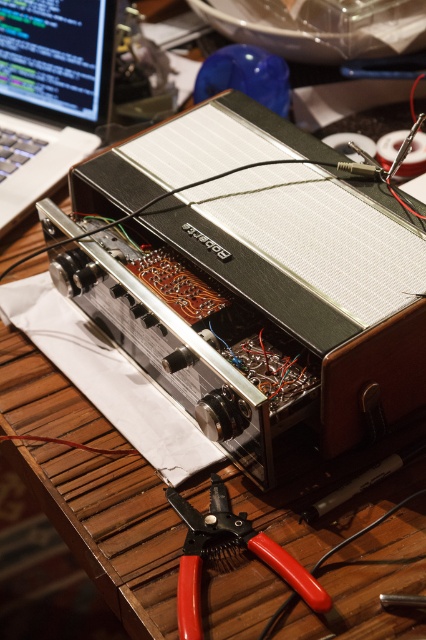
Question: Can you confirm if metallic silver amplifier at center is bigger than red plastic pliers at lower center?

Choices:
 (A) no
 (B) yes

Answer: (B)

Question: Where is metallic silver amplifier at center located in relation to red plastic pliers at lower center in the image?

Choices:
 (A) right
 (B) left

Answer: (A)

Question: Which point is farther to the camera?

Choices:
 (A) red plastic pliers at lower center
 (B) metallic silver amplifier at center
 (C) matte black laptop at upper left

Answer: (C)

Question: Among these points, which one is nearest to the camera?

Choices:
 (A) (19, 166)
 (B) (328, 609)

Answer: (B)

Question: Does matte black laptop at upper left appear on the right side of red plastic pliers at lower center?

Choices:
 (A) yes
 (B) no

Answer: (B)

Question: Which of the following is the closest to the observer?

Choices:
 (A) metallic silver amplifier at center
 (B) red plastic pliers at lower center
 (C) matte black laptop at upper left

Answer: (B)